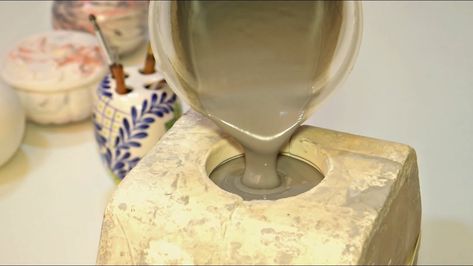
Find the location of `white vase`. white vase is located at coordinates (19, 125).